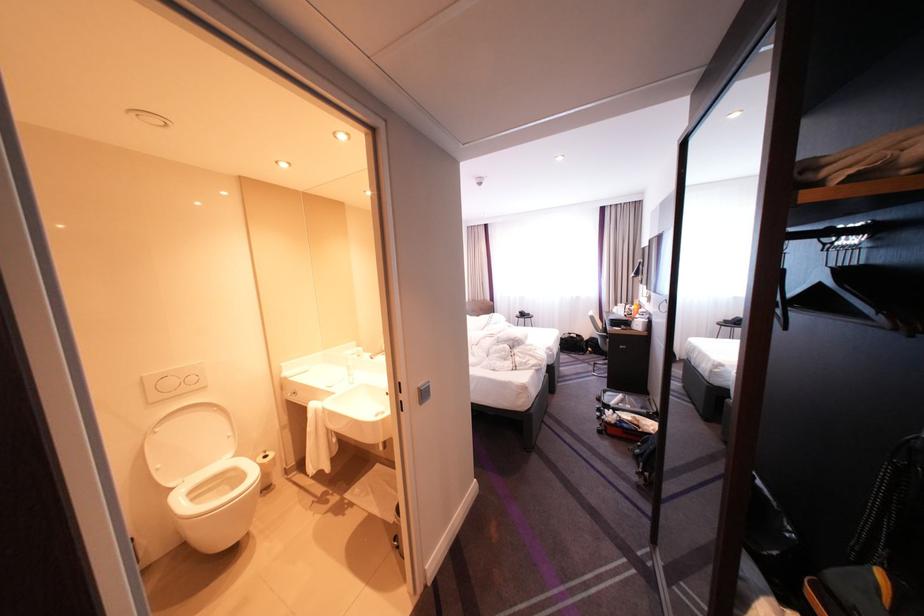
What do you see at coordinates (881, 546) in the screenshot? The height and width of the screenshot is (616, 924). I see `the black backpack` at bounding box center [881, 546].